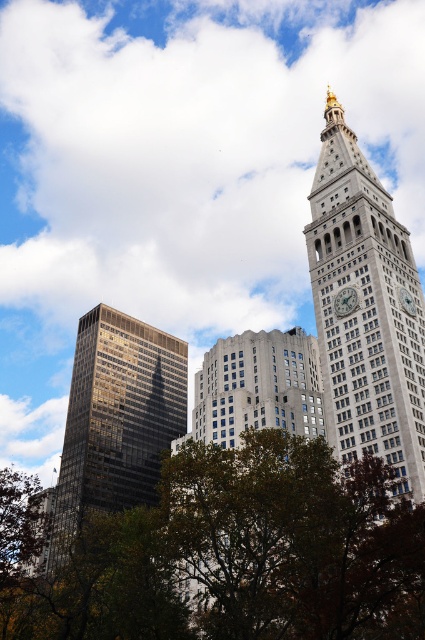
Is green leafy tree at lower center further to camera compared to white marble clock at upper right?

No, it is in front of white marble clock at upper right.

Who is positioned more to the left, green leafy tree at lower center or white marble clock at upper right?

Positioned to the left is green leafy tree at lower center.

Identify the location of green leafy tree at lower center. (240, 554).

Who is more distant from viewer, (105, 628) or (382, 227)?

The point (382, 227) is behind.

Is green leafy tree at lower center taller than gray stone clock tower at upper right?

Incorrect, green leafy tree at lower center's height is not larger of gray stone clock tower at upper right's.

This screenshot has height=640, width=425. I want to click on green leafy tree at lower center, so click(240, 554).

I want to click on green leafy tree at lower center, so click(240, 554).

Between green leafy tree at lower center and white glossy clock at upper right, which one has more height?

Standing taller between the two is green leafy tree at lower center.

Is point (226, 637) positioned behind point (408, 310)?

That is False.

The height and width of the screenshot is (640, 425). Describe the element at coordinates (240, 554) in the screenshot. I see `green leafy tree at lower center` at that location.

You are a GUI agent. You are given a task and a screenshot of the screen. Output one action in this format:
    pyautogui.click(x=<x>, y=<y>)
    Task: Click on the green leafy tree at lower center
    Image resolution: width=425 pixels, height=640 pixels.
    Given the screenshot: What is the action you would take?
    pyautogui.click(x=240, y=554)